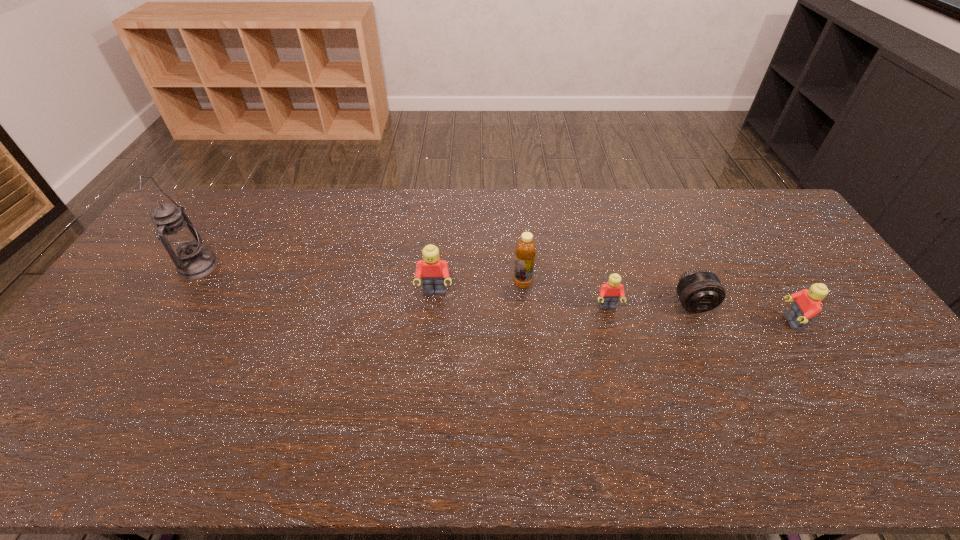
At what (x,y) coordinates should I click in order to perform the action: click on the fifth object from right to left. Please return your answer as a coordinate pair (x, y). The width and height of the screenshot is (960, 540). Looking at the image, I should click on (434, 272).

Where is `the leftmost Lego`? The height and width of the screenshot is (540, 960). the leftmost Lego is located at coordinates coord(434,272).

Identify the location of the fourth object from left to right. This screenshot has width=960, height=540. (609, 294).

The image size is (960, 540). Find the location of `the second Lego from left to right`. the second Lego from left to right is located at coordinates (609, 294).

Find the location of `the rightmost object`. the rightmost object is located at coordinates (807, 304).

In order to click on the fourth tallest object in this screenshot , I will do `click(807, 304)`.

Locate an element on the screen. This screenshot has height=540, width=960. telephoto lens is located at coordinates (699, 290).

Where is `oil lamp`? oil lamp is located at coordinates (181, 240).

Image resolution: width=960 pixels, height=540 pixels. What are the coordinates of `the tallest object` in the screenshot? It's located at (181, 240).

This screenshot has width=960, height=540. Find the location of `bottle`. bottle is located at coordinates click(525, 250).